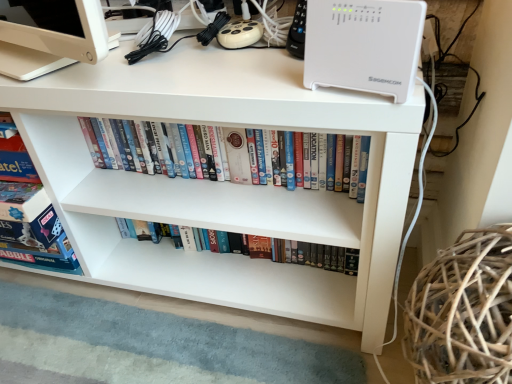
Question: Is white glossy bookshelf at center, the 2th book viewed from the top, positioned beyond the bounds of white plastic dvds at center, the second book from the bottom?

Choices:
 (A) no
 (B) yes

Answer: (B)

Question: Is white glossy bookshelf at center, the 1th book ordered from the bottom, oriented away from white plastic dvds at center, the second book from the bottom?

Choices:
 (A) yes
 (B) no

Answer: (B)

Question: Does white glossy bookshelf at center, the 2th book viewed from the top, have a smaller size compared to white plastic dvds at center, the second book from the bottom?

Choices:
 (A) yes
 (B) no

Answer: (A)

Question: From the image's perspective, would you say white glossy bookshelf at center, the 1th book ordered from the bottom, is positioned over white plastic dvds at center, arranged as the first book when viewed from the top?

Choices:
 (A) no
 (B) yes

Answer: (A)

Question: Considering the relative sizes of white glossy bookshelf at center, the 1th book ordered from the bottom, and white plastic dvds at center, the second book from the bottom, in the image provided, is white glossy bookshelf at center, the 1th book ordered from the bottom, shorter than white plastic dvds at center, the second book from the bottom,?

Choices:
 (A) yes
 (B) no

Answer: (A)

Question: From the image's perspective, relative to white matte desk at upper center, is white glossy bookshelf at center, the 2th book viewed from the top, above or below?

Choices:
 (A) below
 (B) above

Answer: (A)

Question: In terms of height, does white glossy bookshelf at center, the 1th book ordered from the bottom, look taller or shorter compared to white matte desk at upper center?

Choices:
 (A) short
 (B) tall

Answer: (A)

Question: Relative to white matte desk at upper center, is white glossy bookshelf at center, the 2th book viewed from the top, in front or behind?

Choices:
 (A) behind
 (B) front

Answer: (A)

Question: Is white glossy bookshelf at center, the 2th book viewed from the top, inside or outside of white matte desk at upper center?

Choices:
 (A) inside
 (B) outside

Answer: (A)

Question: Is white matte desk at upper center in front of or behind white plastic dvds at center, the second book from the bottom, in the image?

Choices:
 (A) behind
 (B) front

Answer: (B)

Question: Considering the positions of point (309, 233) and point (223, 165), is point (309, 233) closer or farther from the camera than point (223, 165)?

Choices:
 (A) closer
 (B) farther

Answer: (A)

Question: From a real-world perspective, relative to white plastic dvds at center, arranged as the first book when viewed from the top, is white matte desk at upper center vertically above or below?

Choices:
 (A) below
 (B) above

Answer: (A)

Question: From their relative heights in the image, would you say white matte desk at upper center is taller or shorter than white plastic dvds at center, the second book from the bottom?

Choices:
 (A) short
 (B) tall

Answer: (B)

Question: In terms of size, does white matte desk at upper center appear bigger or smaller than white glossy bookshelf at center, the 1th book ordered from the bottom?

Choices:
 (A) small
 (B) big

Answer: (B)

Question: Based on their positions, is white matte desk at upper center located to the left or right of white glossy bookshelf at center, the 2th book viewed from the top?

Choices:
 (A) right
 (B) left

Answer: (B)